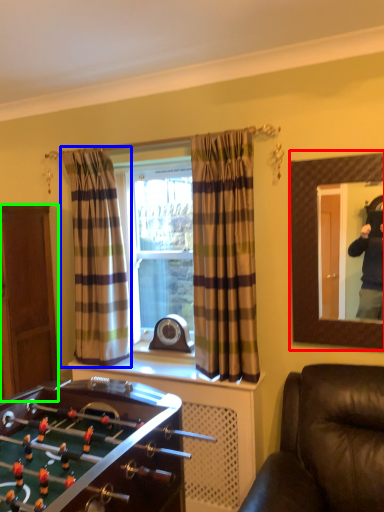
Question: Estimate the real-world distances between objects in this image. Which object is closer to mirror (highlighted by a red box), curtain (highlighted by a blue box) or cabinetry (highlighted by a green box)?

Choices:
 (A) curtain
 (B) cabinetry

Answer: (A)